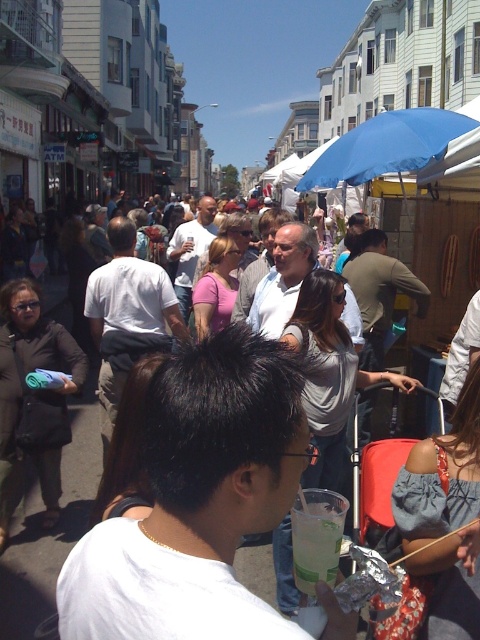
Question: Does white plastic cup at center have a smaller size compared to clear plastic cup at center?

Choices:
 (A) yes
 (B) no

Answer: (B)

Question: Is white plastic cup at center further to the viewer compared to white cotton shirt at center?

Choices:
 (A) no
 (B) yes

Answer: (A)

Question: Based on their relative distances, which object is nearer to the white cotton shirt at center?

Choices:
 (A) clear plastic cup at center
 (B) white plastic cup at center
 (C) blue fabric umbrella at upper right

Answer: (A)

Question: Which point appears closest to the camera in this image?

Choices:
 (A) (156, 387)
 (B) (340, 170)
 (C) (292, 552)
 (D) (477, 566)

Answer: (A)

Question: Can you confirm if white plastic cup at center is wider than blue fabric umbrella at upper right?

Choices:
 (A) yes
 (B) no

Answer: (B)

Question: Among these objects, which one is nearest to the camera?

Choices:
 (A) clear plastic cup at center
 (B) white cotton shirt at center
 (C) white plastic cup at center
 (D) blue fabric umbrella at upper right

Answer: (C)